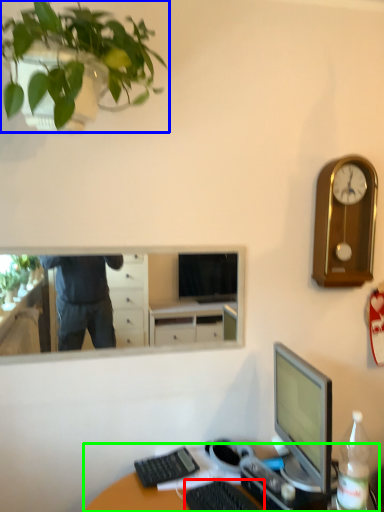
Question: Based on their relative distances, which object is farther from computer keyboard (highlighted by a red box)? Choose from houseplant (highlighted by a blue box) and desk (highlighted by a green box).

Choices:
 (A) houseplant
 (B) desk

Answer: (A)